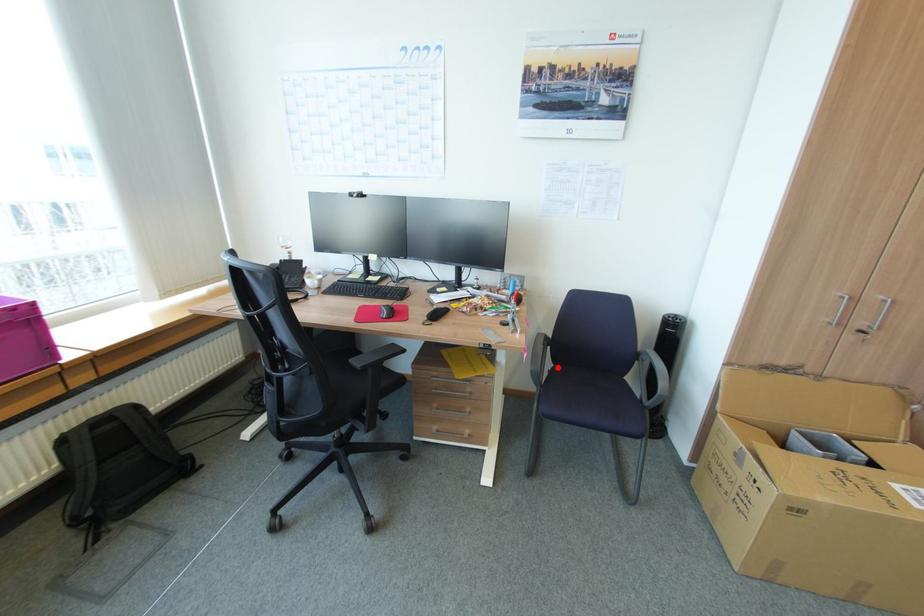
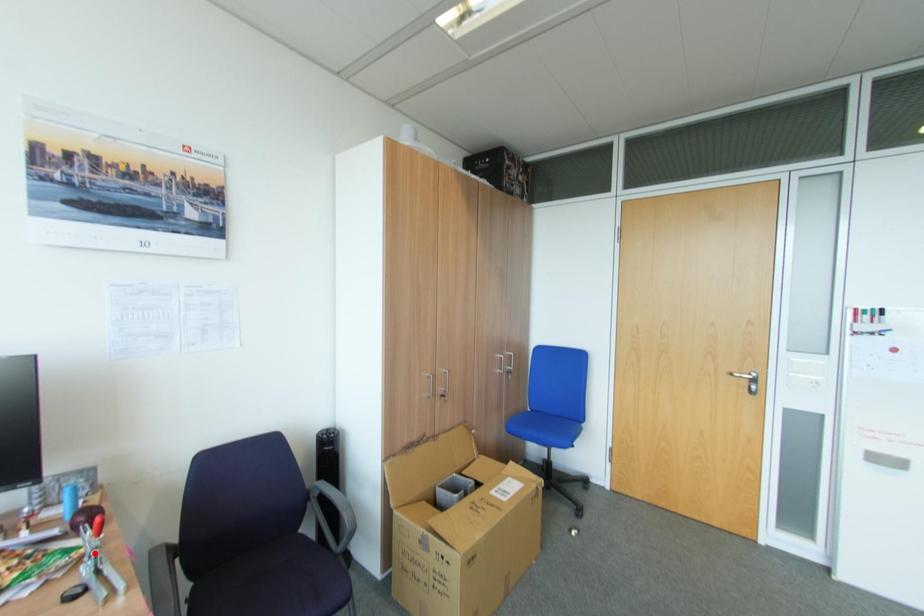
I am providing you with two images of the same scene from different viewpoints. A red point is marked on the first image and another point is marked on the second image. Is the red point in image1 aligned with the point shown in image2?

No